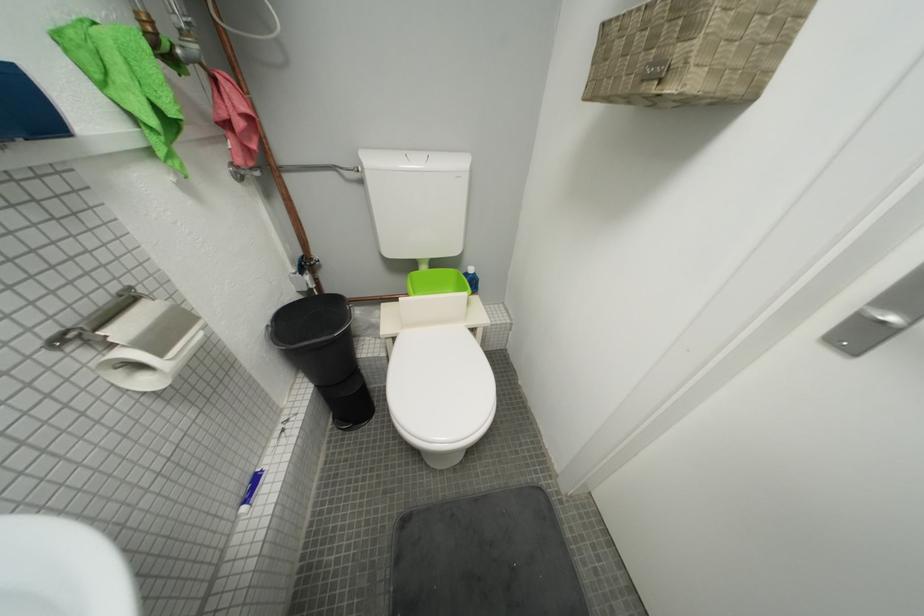
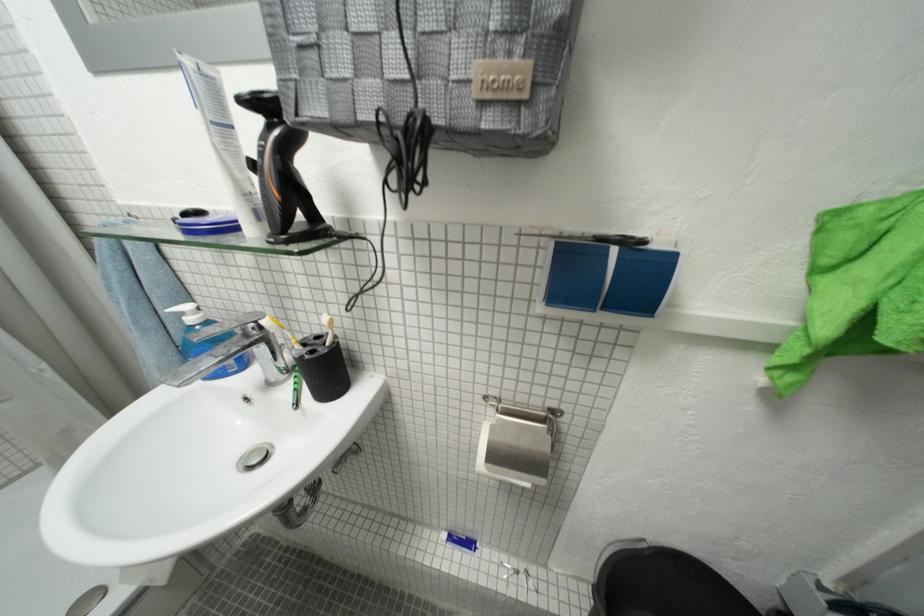
Based on the continuous images, in which direction is the camera rotating?

The camera's rotation is toward left-down.